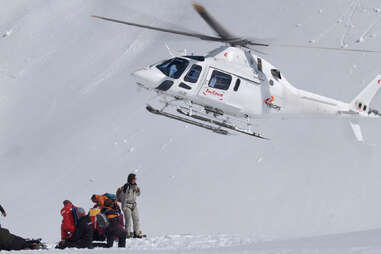
The height and width of the screenshot is (254, 381). In order to click on windows in this screenshot , I will do `click(219, 81)`, `click(235, 83)`, `click(191, 76)`, `click(177, 69)`.